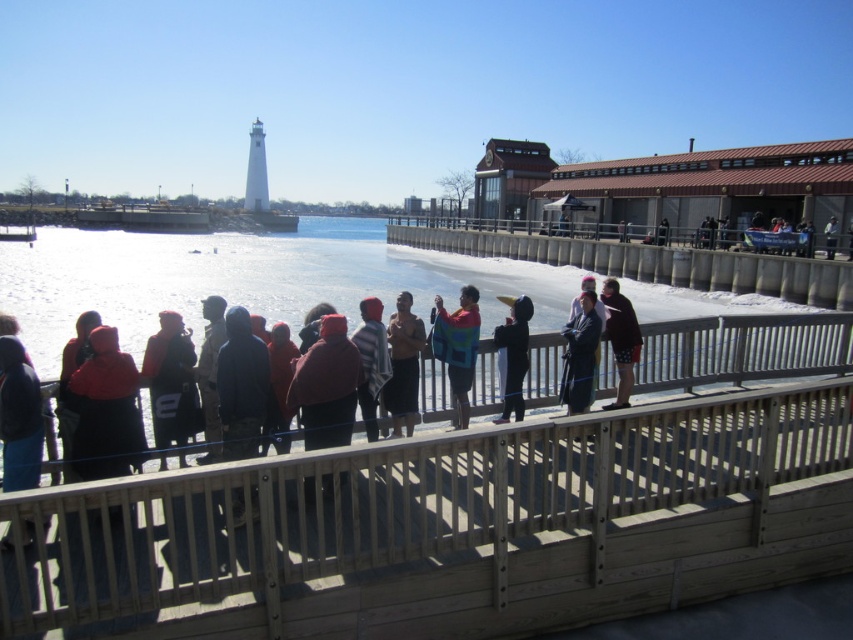
You are a GUI agent. You are given a task and a screenshot of the screen. Output one action in this format:
    pyautogui.click(x=<x>, y=<y>)
    Task: Click on the knitted multicolored sweater at center
    Image resolution: width=853 pixels, height=640 pixels.
    Given the screenshot: What is the action you would take?
    pyautogui.click(x=457, y=348)

Does knitted multicolored sweater at center have a smaller size compared to dark blue fabric at center?

Correct, knitted multicolored sweater at center occupies less space than dark blue fabric at center.

Is point (457, 353) positioned in front of point (625, 376)?

Yes, point (457, 353) is closer to viewer.

Locate an element on the screen. This screenshot has height=640, width=853. knitted multicolored sweater at center is located at coordinates (457, 348).

Between matte black jacket at center and shiny metallic tank top at center, which one has less height?

Standing shorter between the two is shiny metallic tank top at center.

Does matte black jacket at center have a greater height compared to shiny metallic tank top at center?

Correct, matte black jacket at center is much taller as shiny metallic tank top at center.

The width and height of the screenshot is (853, 640). Describe the element at coordinates (170, 381) in the screenshot. I see `matte black jacket at center` at that location.

Find the location of a particular element. The width and height of the screenshot is (853, 640). matte black jacket at center is located at coordinates (170, 381).

Does shiny metallic tank top at center have a greater height compared to dark gray jacket at center?

No.

Which is above, shiny metallic tank top at center or dark gray jacket at center?

dark gray jacket at center is higher up.

Between point (412, 320) and point (587, 308), which one is positioned behind?

The point (587, 308) is behind.

The image size is (853, 640). I want to click on shiny metallic tank top at center, so click(403, 365).